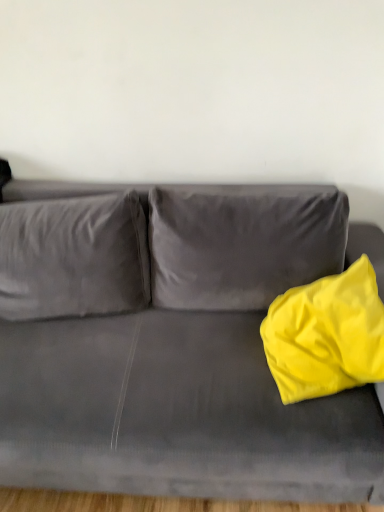
Question: From a real-world perspective, is yellow fabric pillow at right over matte gray couch at center?

Choices:
 (A) no
 (B) yes

Answer: (B)

Question: Is yellow fabric pillow at right turned away from matte gray couch at center?

Choices:
 (A) yes
 (B) no

Answer: (A)

Question: From the image's perspective, does yellow fabric pillow at right appear lower than matte gray couch at center?

Choices:
 (A) yes
 (B) no

Answer: (B)

Question: Is yellow fabric pillow at right thinner than matte gray couch at center?

Choices:
 (A) no
 (B) yes

Answer: (B)

Question: Considering the relative sizes of yellow fabric pillow at right and matte gray couch at center in the image provided, is yellow fabric pillow at right shorter than matte gray couch at center?

Choices:
 (A) yes
 (B) no

Answer: (A)

Question: Is yellow fabric pillow at right positioned beyond the bounds of matte gray couch at center?

Choices:
 (A) no
 (B) yes

Answer: (A)

Question: Is matte gray couch at center outside of yellow fabric pillow at right?

Choices:
 (A) no
 (B) yes

Answer: (B)

Question: Is matte gray couch at center thinner than yellow fabric pillow at right?

Choices:
 (A) yes
 (B) no

Answer: (B)

Question: Can you confirm if matte gray couch at center is bigger than yellow fabric pillow at right?

Choices:
 (A) yes
 (B) no

Answer: (A)

Question: Does matte gray couch at center come in front of yellow fabric pillow at right?

Choices:
 (A) yes
 (B) no

Answer: (A)

Question: From a real-world perspective, is matte gray couch at center located higher than yellow fabric pillow at right?

Choices:
 (A) yes
 (B) no

Answer: (B)

Question: Is matte gray couch at center next to yellow fabric pillow at right?

Choices:
 (A) yes
 (B) no

Answer: (B)

Question: From the image's perspective, is yellow fabric pillow at right above or below matte gray couch at center?

Choices:
 (A) above
 (B) below

Answer: (A)